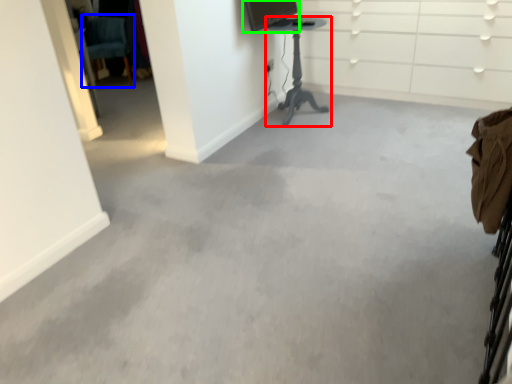
Question: Estimate the real-world distances between objects in this image. Which object is closer to furniture (highlighted by a red box), swivel chair (highlighted by a blue box) or computer monitor (highlighted by a green box)?

Choices:
 (A) swivel chair
 (B) computer monitor

Answer: (B)